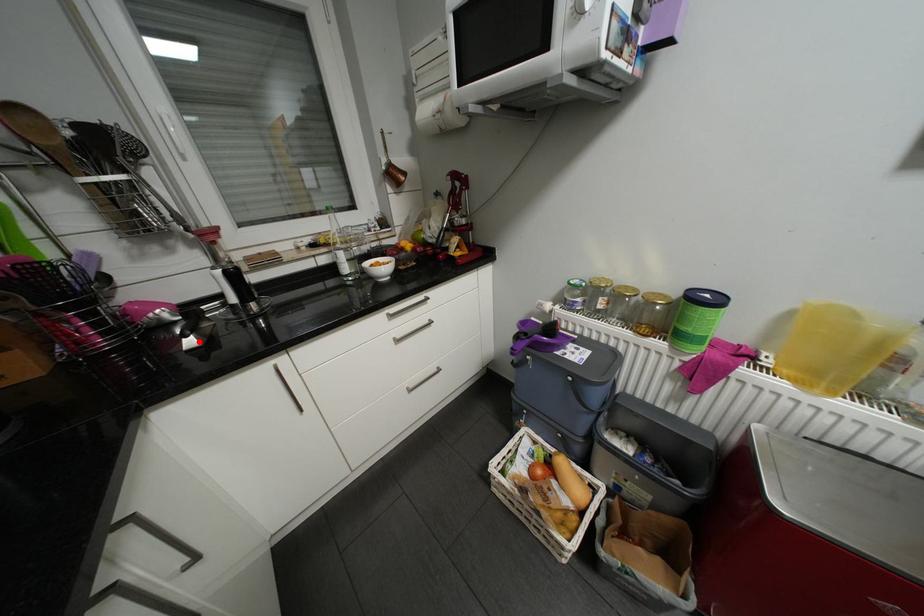
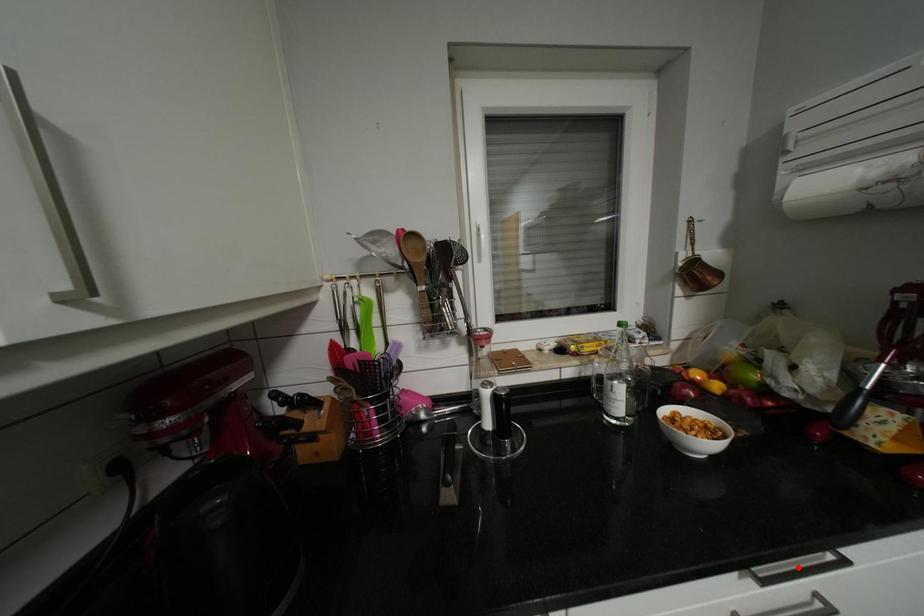
I am providing you with two images of the same scene from different viewpoints. A red point is marked on the first image and another point is marked on the second image. Is the marked point in image1 the same physical position as the marked point in image2?

No